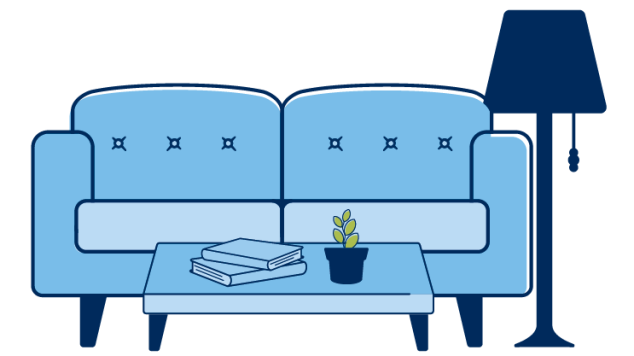
The width and height of the screenshot is (634, 356). I want to click on stand, so click(547, 164).